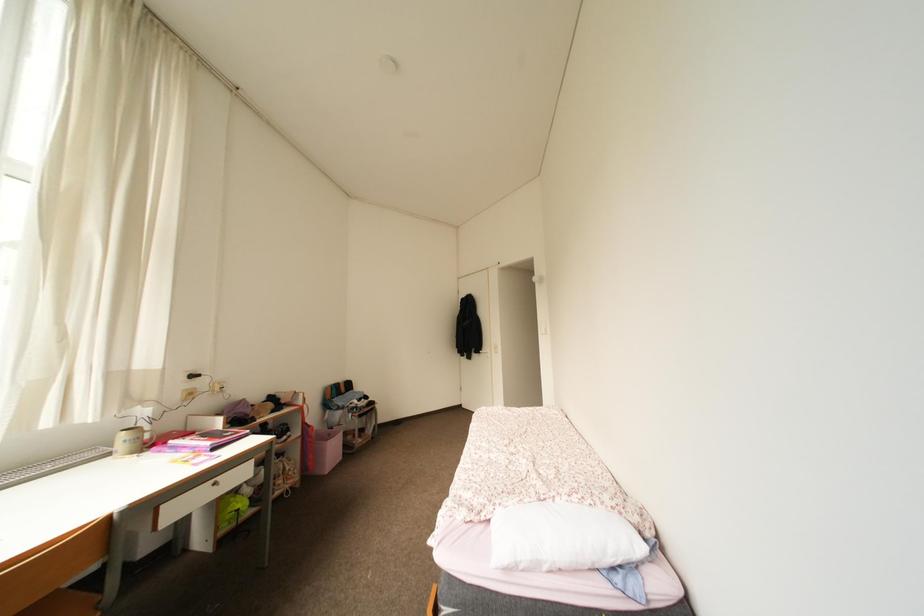
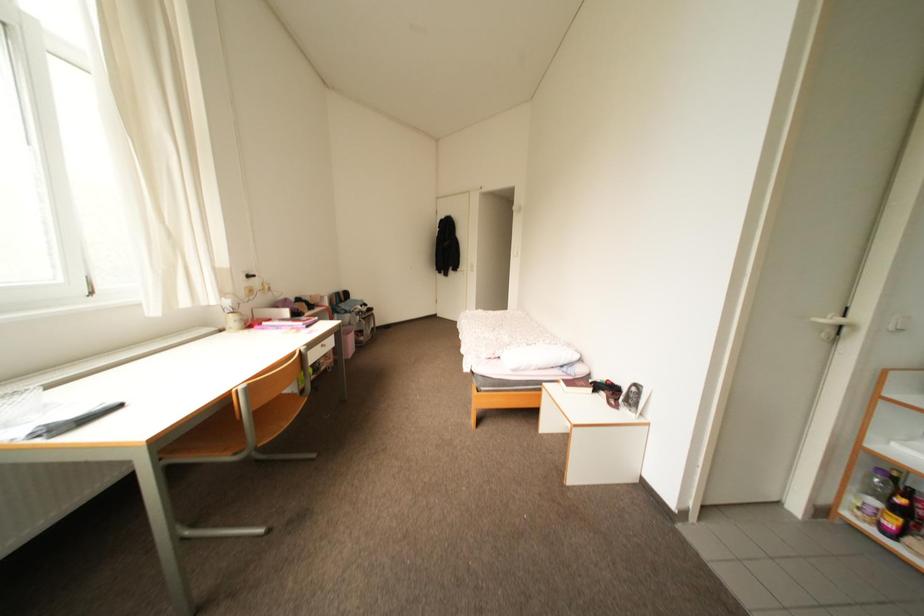
Question: Based on the continuous images, in which direction is the camera rotating? Reply with the corresponding letter.

Choices:
 (A) Left
 (B) Right
 (C) Up
 (D) Down

Answer: (D)